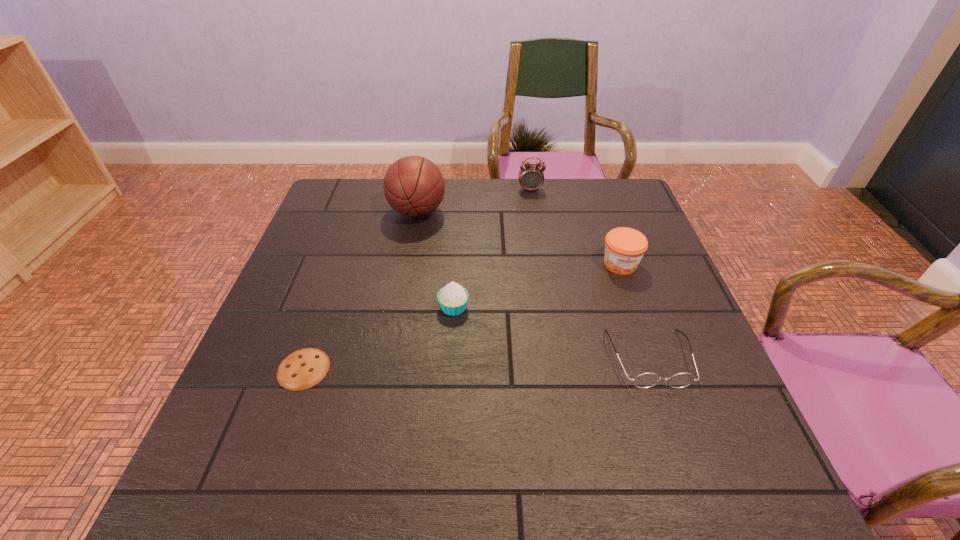
This screenshot has height=540, width=960. Identify the location of basketball. pyautogui.click(x=413, y=186).

Locate an element on the screen. The height and width of the screenshot is (540, 960). the second object from left to right is located at coordinates (413, 186).

This screenshot has height=540, width=960. I want to click on the farthest object, so click(531, 176).

Locate an element on the screen. the fifth shortest object is located at coordinates (531, 176).

The image size is (960, 540). In order to click on jam in this screenshot , I will do `click(624, 247)`.

At what (x,y) coordinates should I click in order to perform the action: click on the third object from left to right. Please return your answer as a coordinate pair (x, y). This screenshot has height=540, width=960. Looking at the image, I should click on (453, 298).

This screenshot has height=540, width=960. I want to click on the third nearest object, so click(x=453, y=298).

This screenshot has height=540, width=960. What are the coordinates of `spectacles` in the screenshot? It's located at (645, 380).

Locate an element on the screen. cookie is located at coordinates (304, 368).

The height and width of the screenshot is (540, 960). Find the location of `the shortest object`. the shortest object is located at coordinates (304, 368).